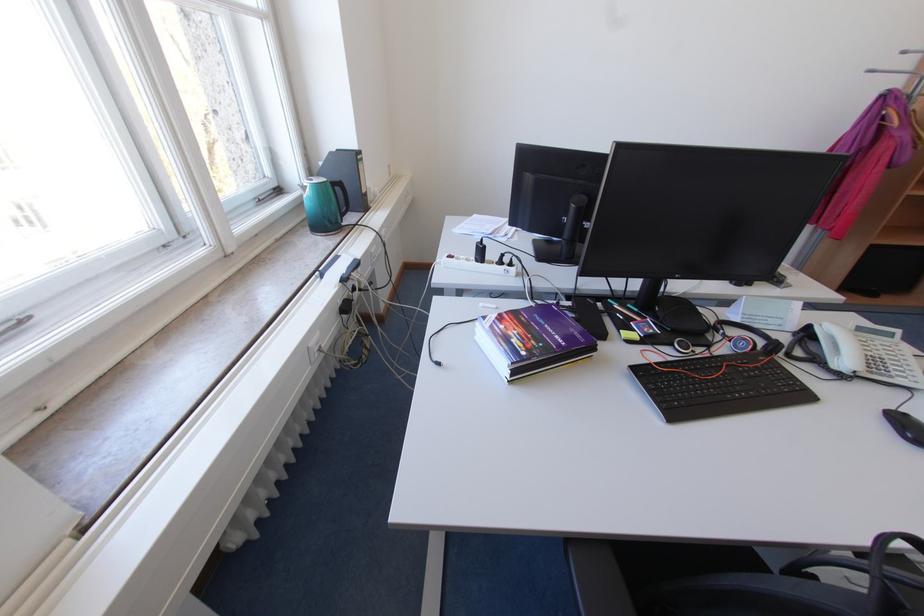
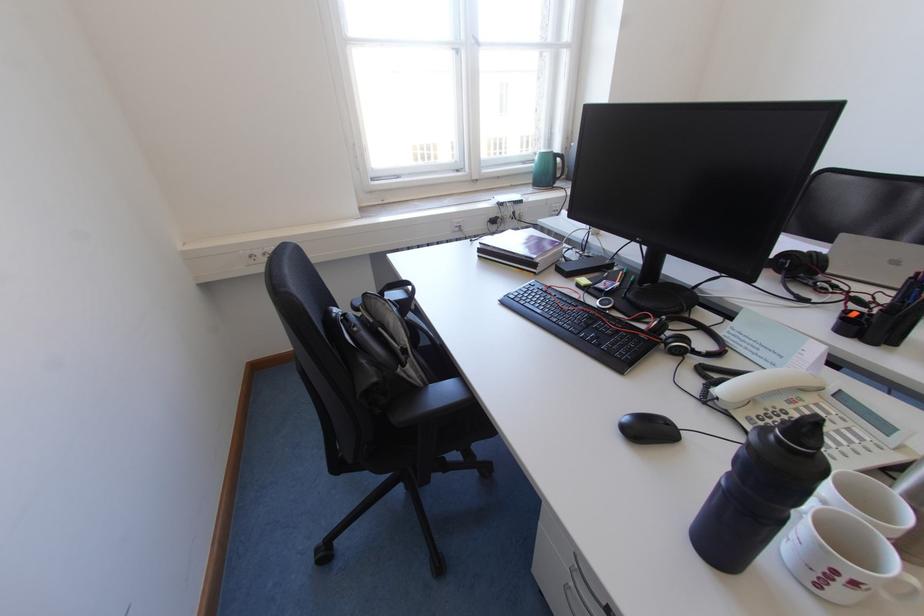
Where in the second image is the point corresponding to pixel 346 190 from the first image?

(566, 161)